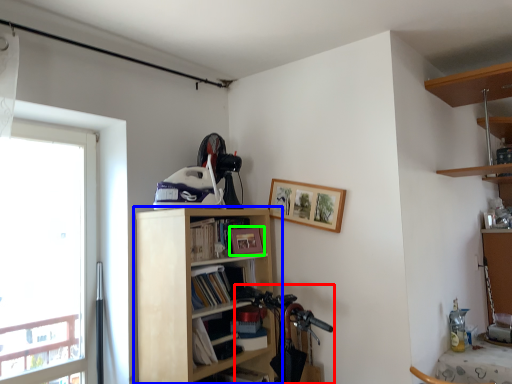
Question: Estimate the real-world distances between objects in this image. Which object is closer to mountain bike (highlighted by a red box), shelf (highlighted by a blue box) or picture frame (highlighted by a green box)?

Choices:
 (A) shelf
 (B) picture frame

Answer: (A)